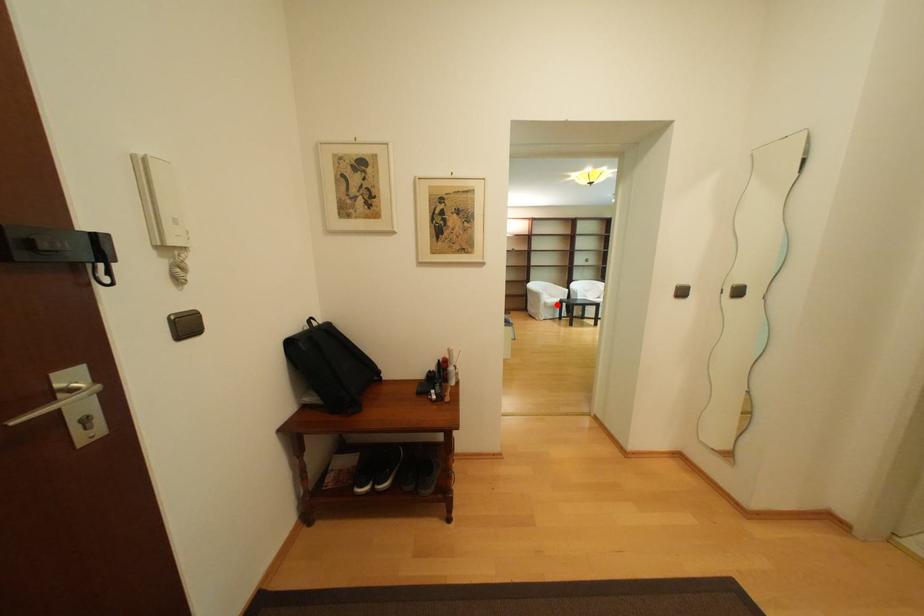
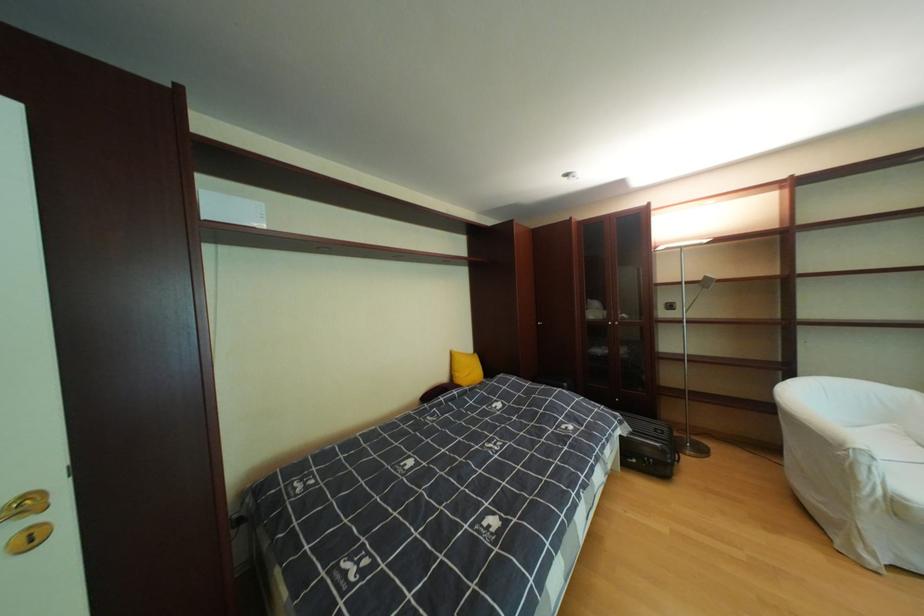
Question: I am providing you with two images of the same scene from different viewpoints. Given a red point in image1, look at the same physical point in image2. Is it:

Choices:
 (A) Closer to the viewpoint
 (B) Farther from the viewpoint

Answer: (A)